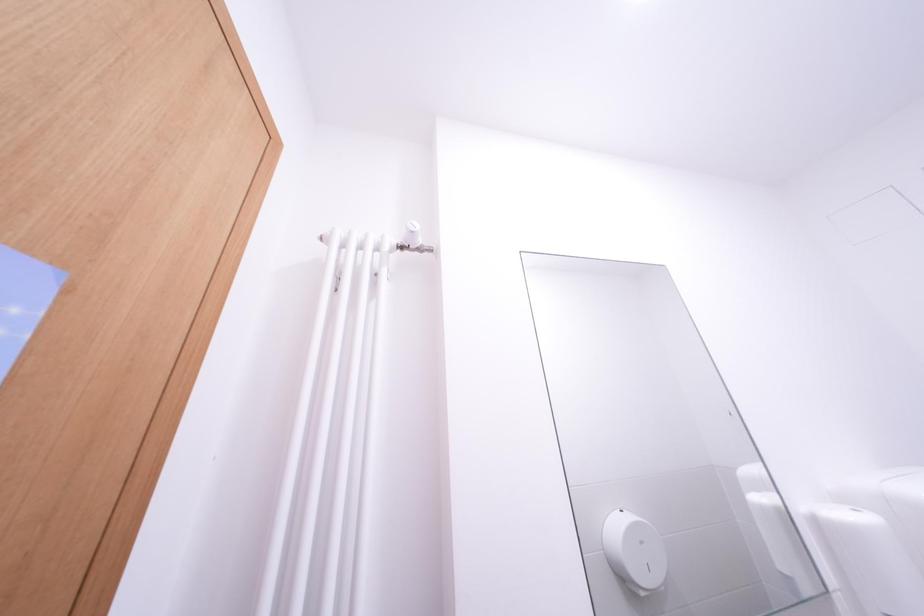
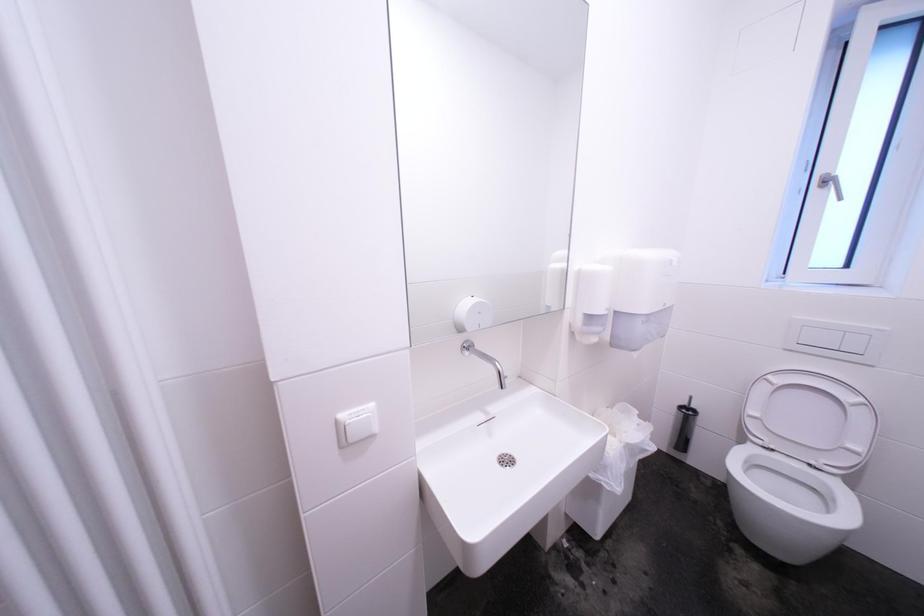
How did the camera likely rotate?

The rotation direction of the camera is right-down.